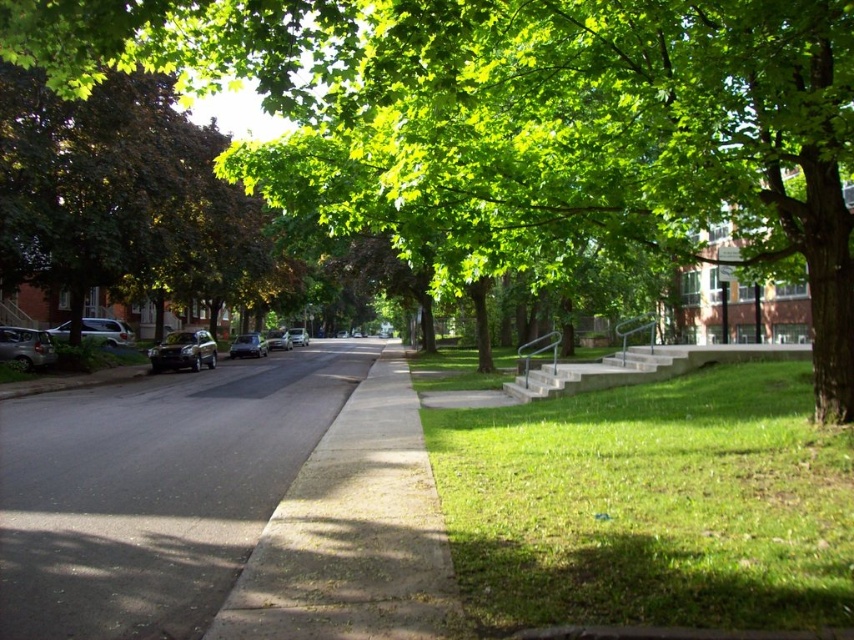
You are a pedestrian standing on the sidewalk and want to cross the street to reach the grassy area. There is a gray concrete curb at lower left and a matte black suv at left. Which object should you avoid stepping over to safely reach the grassy area?

You should avoid stepping over the gray concrete curb at lower left because it is positioned under the matte black suv at left, indicating it is near the road where the SUV is parked. To safely reach the grassy area, stay on the sidewalk away from the curb and the SUV.

You are standing on the sidewalk and want to walk to the grassy area. Which direction should you go relative to the green leafy tree at left?

The green leafy tree at left is located at point (123, 196), so you should walk towards the right side of the tree to reach the grassy area on the other side.